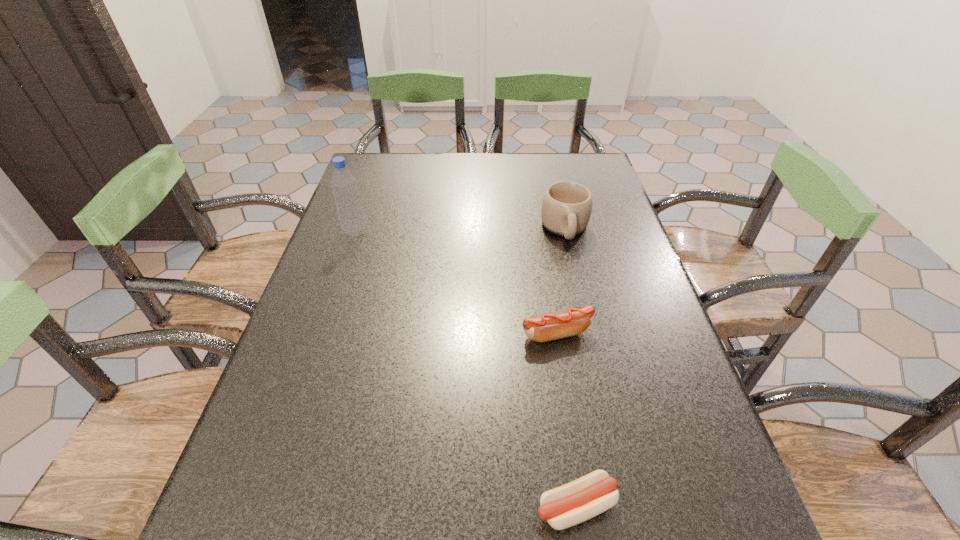
Identify the location of vacant area that lies between the second nearest object and the shortest object. (565, 420).

Where is `vacant area that lies between the mug and the second shortest object`? This screenshot has width=960, height=540. vacant area that lies between the mug and the second shortest object is located at coordinates (561, 281).

At what (x,y) coordinates should I click in order to perform the action: click on object that is the closest one to the farther sausage. Please return your answer as a coordinate pair (x, y). Looking at the image, I should click on (566, 207).

Image resolution: width=960 pixels, height=540 pixels. Find the location of `object that is the second closest to the taller sausage`. object that is the second closest to the taller sausage is located at coordinates (584, 498).

Identify which sausage is the second closest to the mug. Please provide its 2D coordinates. Your answer should be formatted as a tuple, i.e. [(x, y)], where the tuple contains the x and y coordinates of a point satisfying the conditions above.

[(584, 498)]